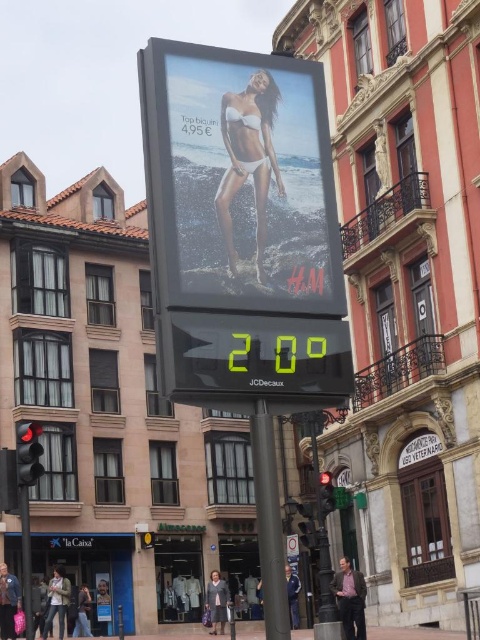
Who is shorter, black metal pole at center or blue fabric jacket at center?

black metal pole at center is shorter.

Who is lower down, black metal pole at center or blue fabric jacket at center?

blue fabric jacket at center is below.

Who is more distant from viewer, (286,625) or (296,612)?

Point (296,612)

Locate an element on the screen. black metal pole at center is located at coordinates (268, 524).

Between point (355, 636) and point (220, 614), which one is positioned in front?

Point (355, 636) is in front.

Is pink fabric shirt at lower center positioned before matte gray coat at center?

Yes, it is in front of matte gray coat at center.

Does point (333, 579) come in front of point (222, 582)?

Yes, point (333, 579) is closer to viewer.

Where is `pink fabric shirt at lower center`? This screenshot has height=640, width=480. pink fabric shirt at lower center is located at coordinates (349, 600).

Can you confirm if light brown leather jacket at lower left is wider than red glass traffic light at center?

Incorrect, light brown leather jacket at lower left's width does not surpass red glass traffic light at center's.

Is light brown leather jacket at lower left bigger than red glass traffic light at center?

No.

Where is `light brown leather jacket at lower left`? light brown leather jacket at lower left is located at coordinates (57, 602).